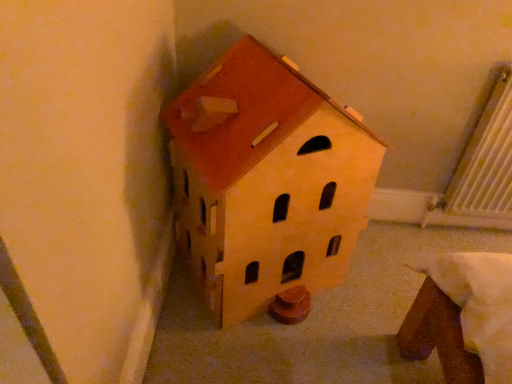
The width and height of the screenshot is (512, 384). What are the coordinates of `vacant area that is in front of matte wood house at center` in the screenshot? It's located at (261, 355).